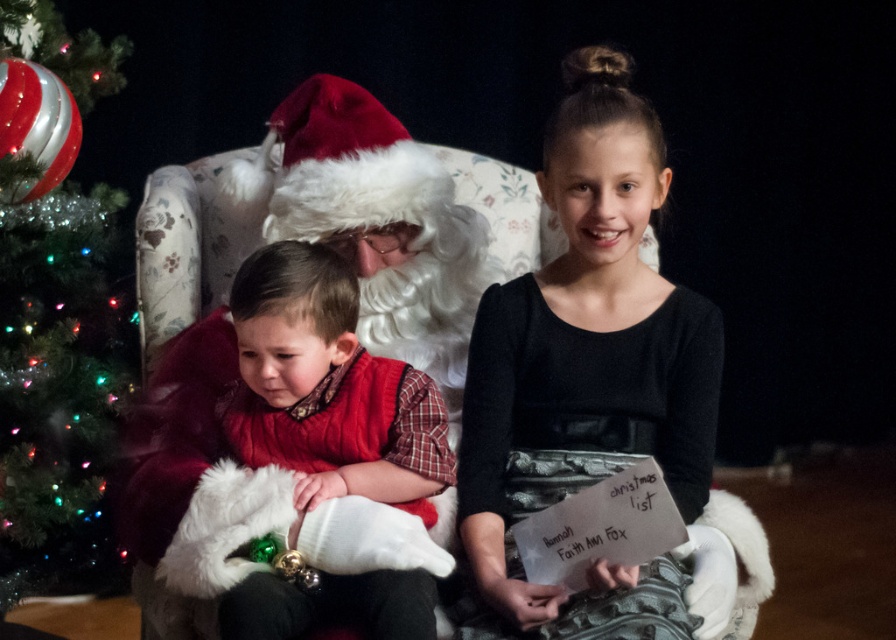
Who is shorter, black satin dress at center or white paper at center?

white paper at center

Can you confirm if black satin dress at center is bigger than white paper at center?

Correct, black satin dress at center is larger in size than white paper at center.

Who is more forward, [520,502] or [653,490]?

Point [653,490]

Where is `black satin dress at center`? The image size is (896, 640). black satin dress at center is located at coordinates (599, 390).

Does black satin dress at center come behind matte red vest at center?

No, black satin dress at center is closer to the viewer.

What do you see at coordinates (599, 390) in the screenshot?
I see `black satin dress at center` at bounding box center [599, 390].

Between point (547, 369) and point (367, 381), which one is positioned behind?

The point (367, 381) is more distant.

The width and height of the screenshot is (896, 640). I want to click on black satin dress at center, so click(599, 390).

Does matte red vest at center appear on the left side of shiny glass ornament at left?

Incorrect, matte red vest at center is not on the left side of shiny glass ornament at left.

Is matte red vest at center in front of shiny glass ornament at left?

Yes, it is.

Where is `matte red vest at center`? matte red vest at center is located at coordinates (296, 461).